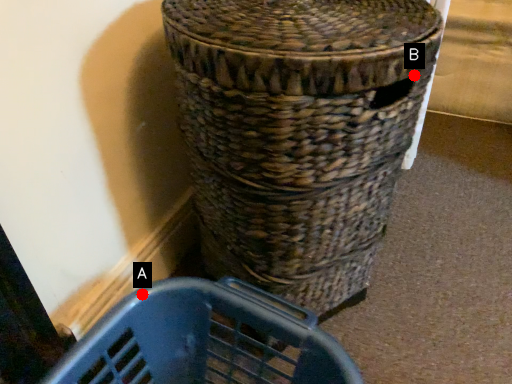
Question: Two points are circled on the image, labeled by A and B beside each circle. Among these points, which one is farthest from the camera?

Choices:
 (A) A is further
 (B) B is further

Answer: (A)